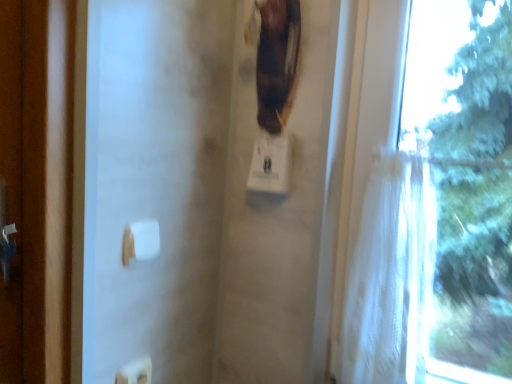
Question: Considering the relative positions of white plastic light switch at lower center and white sheer fabric at right in the image provided, is white plastic light switch at lower center to the left or to the right of white sheer fabric at right?

Choices:
 (A) left
 (B) right

Answer: (A)

Question: Is point (146, 380) closer or farther from the camera than point (403, 269)?

Choices:
 (A) farther
 (B) closer

Answer: (B)

Question: Which of these objects is positioned farthest from the brown leather guitar at upper center?

Choices:
 (A) white sheer curtain at right
 (B) white plastic light switch at lower center
 (C) white sheer fabric at right
 (D) white plastic towel bar at lower center

Answer: (B)

Question: Estimate the real-world distances between objects in this image. Which object is farther from the white plastic towel bar at lower center?

Choices:
 (A) white sheer curtain at right
 (B) white plastic light switch at lower center
 (C) white sheer fabric at right
 (D) brown leather guitar at upper center

Answer: (A)